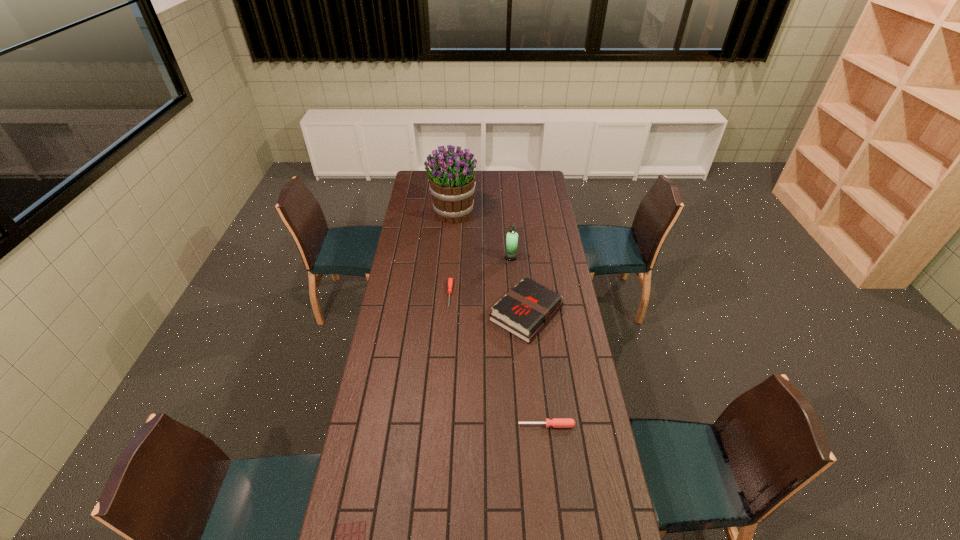
Locate an element on the screen. The height and width of the screenshot is (540, 960). free region that satisfies the following two spatial constraints: 1. on the front side of the bouquet; 2. on the right side of the thermos bottle is located at coordinates (450, 258).

Find the location of `free space in the image that satisfies the following two spatial constraints: 1. at the tip of the taller screwdriver; 2. on the left side of the shorter screwdriver`. free space in the image that satisfies the following two spatial constraints: 1. at the tip of the taller screwdriver; 2. on the left side of the shorter screwdriver is located at coordinates (441, 425).

The height and width of the screenshot is (540, 960). What are the coordinates of `free space in the image that satisfies the following two spatial constraints: 1. at the tip of the fifth farthest object; 2. on the left side of the left screwdriver` in the screenshot? It's located at (441, 425).